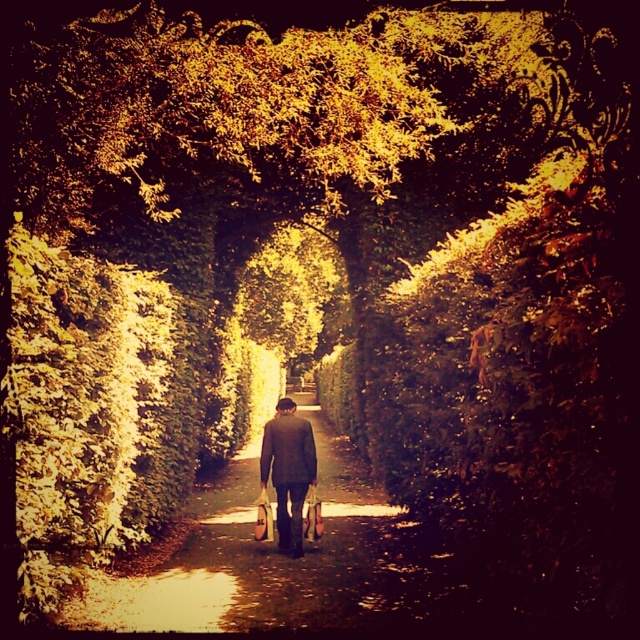
Question: Where is brown textured path at center located in relation to dark brown suit at center in the image?

Choices:
 (A) below
 (B) above

Answer: (A)

Question: Does brown textured path at center appear under dark brown suit at center?

Choices:
 (A) yes
 (B) no

Answer: (A)

Question: Which point is farther from the camera taking this photo?

Choices:
 (A) (83, 616)
 (B) (278, 516)

Answer: (B)

Question: In this image, where is brown textured path at center located relative to dark brown suit at center?

Choices:
 (A) below
 (B) above

Answer: (A)